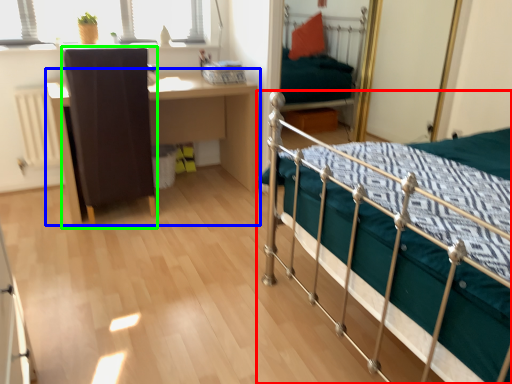
Question: Which is nearer to the bed (highlighted by a red box)? desk (highlighted by a blue box) or chair (highlighted by a green box).

Choices:
 (A) desk
 (B) chair

Answer: (B)